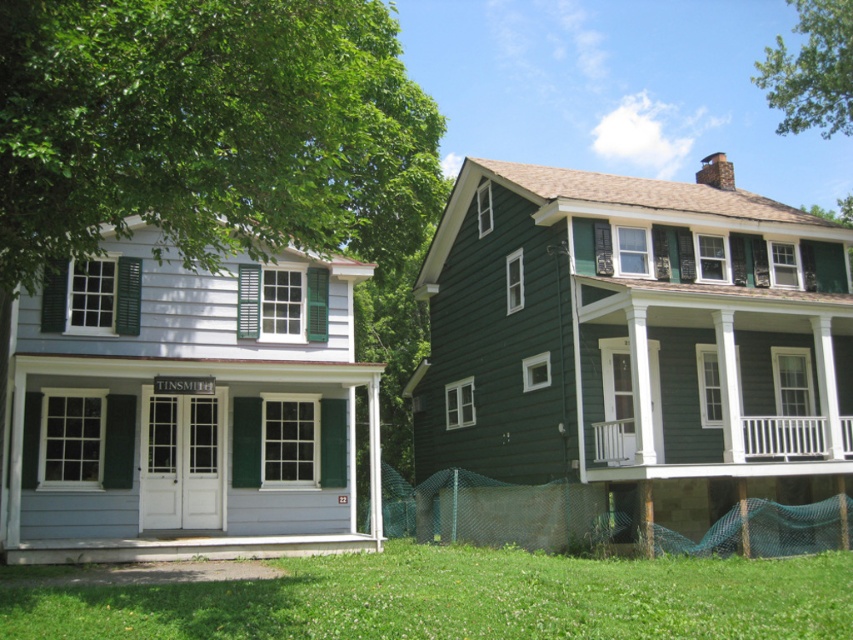
You are standing in front of the two buildings and want to walk from the green painted wood shutter at center to the white painted wood porch at center. Which direction should you move?

You should move to the right to reach the white painted wood porch at center from the green painted wood shutter at center because the white painted wood porch at center is located to the right of the green painted wood shutter at center.

What is the location of the white painted wood porch at center in the image?

The white painted wood porch at center is located at point [756,452].